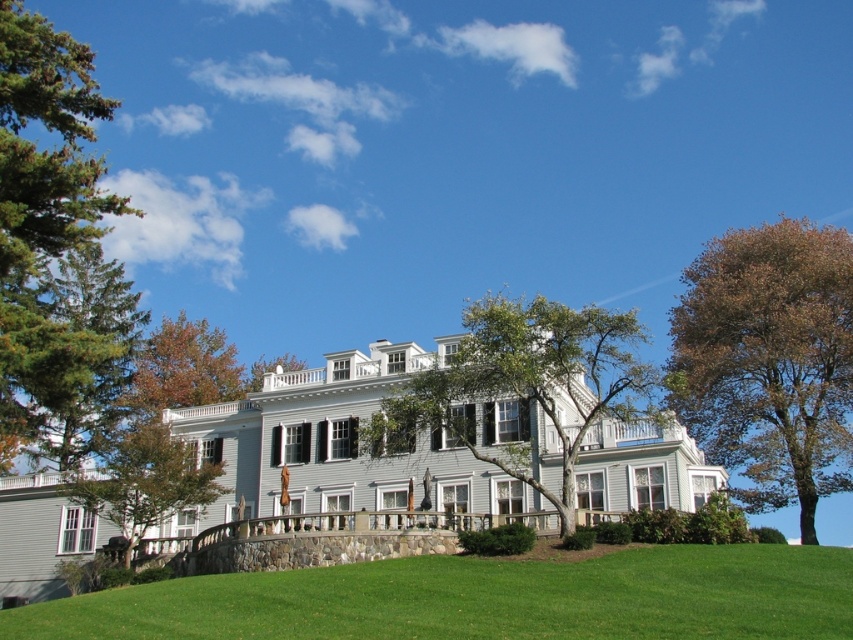
Question: Does green needle-like at left appear on the right side of green leafy tree at lower left?

Choices:
 (A) yes
 (B) no

Answer: (B)

Question: Based on their relative distances, which object is farther from the green leafy tree at center?

Choices:
 (A) brown leafy tree at right
 (B) green grass at lower center
 (C) green leafy tree at lower left
 (D) green needle-like at left

Answer: (D)

Question: Is the position of green grass at lower center less distant than that of green needle-like at left?

Choices:
 (A) no
 (B) yes

Answer: (B)

Question: Does green grass at lower center have a lesser width compared to green leafy tree at center?

Choices:
 (A) yes
 (B) no

Answer: (A)

Question: Which object appears closest to the camera in this image?

Choices:
 (A) green leafy tree at center
 (B) green needle-like at left

Answer: (B)

Question: Which point is closer to the camera taking this photo?

Choices:
 (A) (45, 621)
 (B) (68, 400)
 (C) (708, 346)

Answer: (A)